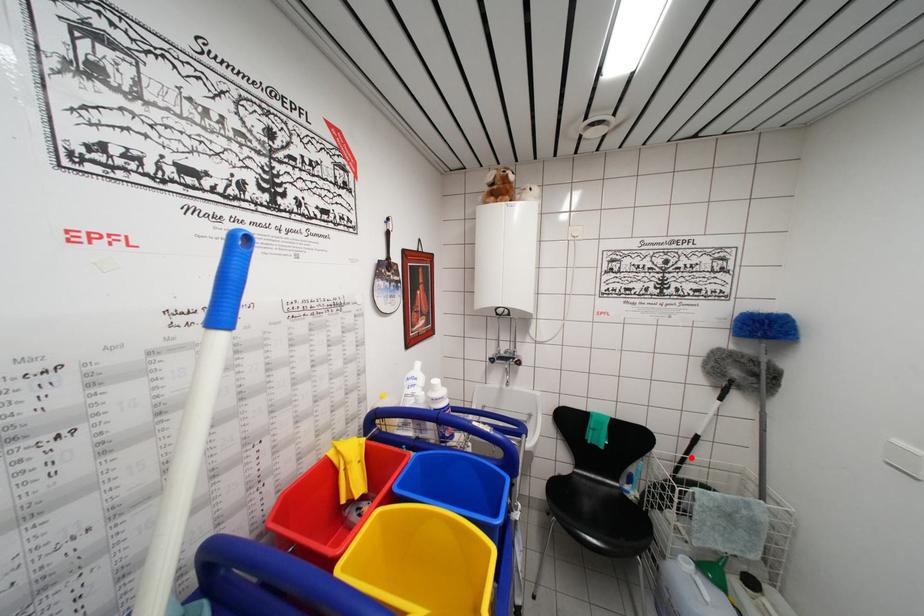
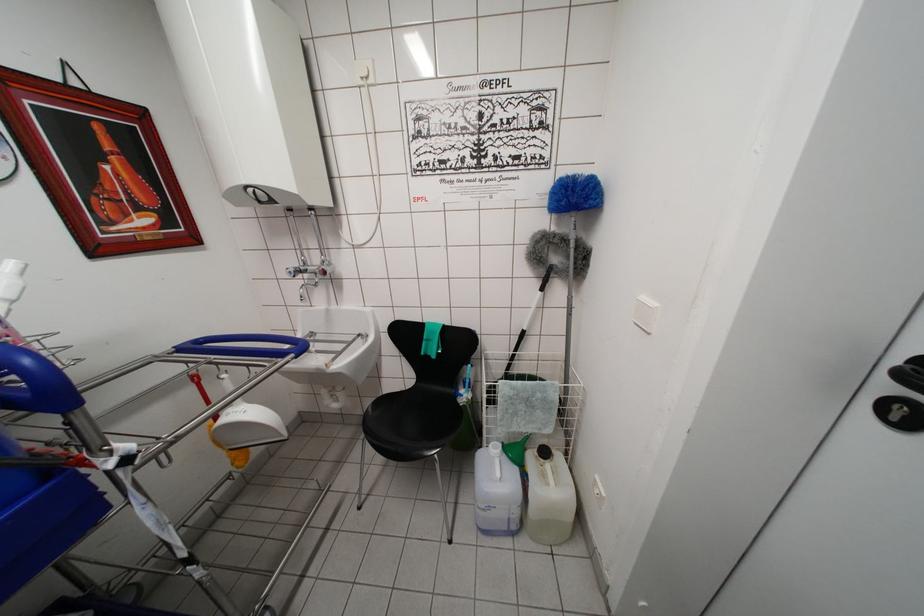
Question: I am providing you with two images of the same scene from different viewpoints. A red point is marked on the first image. Can you still see the location of the red point in image 2?

Choices:
 (A) Yes
 (B) No

Answer: (A)